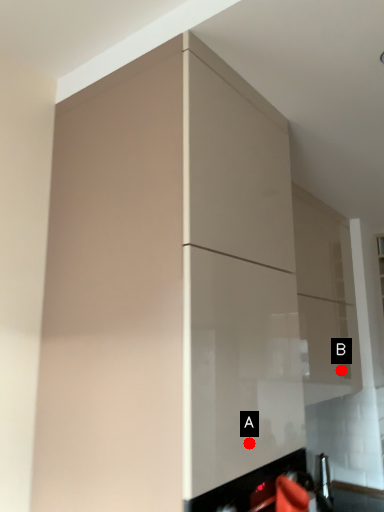
Question: Two points are circled on the image, labeled by A and B beside each circle. Which point appears farthest from the camera in this image?

Choices:
 (A) A is further
 (B) B is further

Answer: (B)